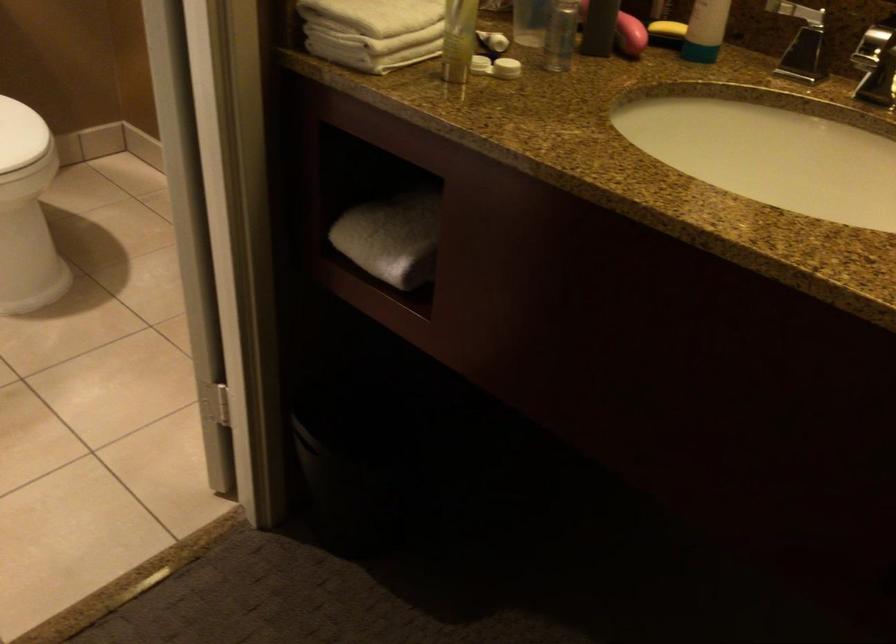
What do you see at coordinates (630, 35) in the screenshot?
I see `the pink soap bar` at bounding box center [630, 35].